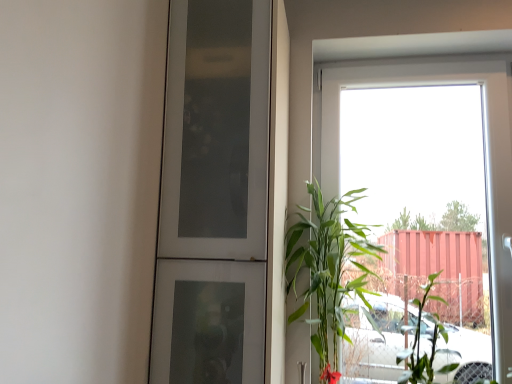
Question: Is point [x=419, y=301] closer or farther from the camera than point [x=336, y=316]?

Choices:
 (A) closer
 (B) farther

Answer: (B)

Question: From a real-world perspective, is green leafy plant at right positioned above or below green leafy plant at right?

Choices:
 (A) below
 (B) above

Answer: (A)

Question: Estimate the real-world distances between objects in this image. Which object is closer to the green leafy plant at right?

Choices:
 (A) green leafy plant at right
 (B) transparent glass window at upper right
 (C) white frosted glass door at center

Answer: (A)

Question: Estimate the real-world distances between objects in this image. Which object is closer to the white frosted glass door at center?

Choices:
 (A) green leafy plant at right
 (B) transparent glass window at upper right
 (C) green leafy plant at right

Answer: (A)